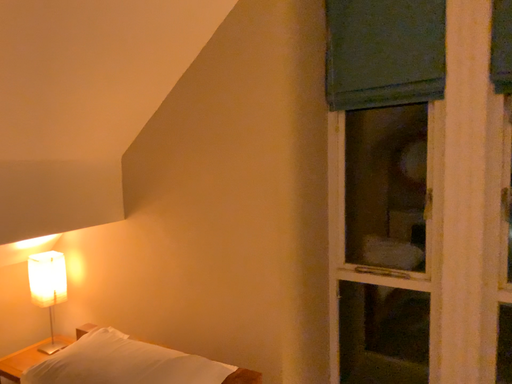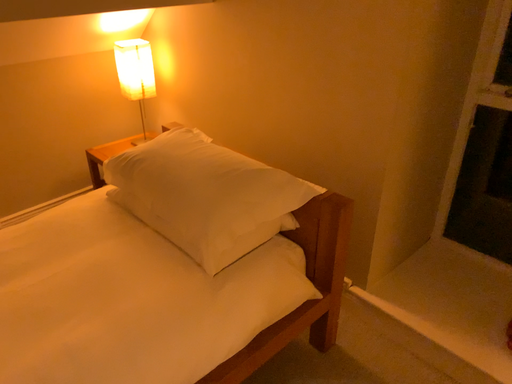
Question: How did the camera likely rotate when shooting the video?

Choices:
 (A) rotated upward
 (B) rotated downward

Answer: (B)